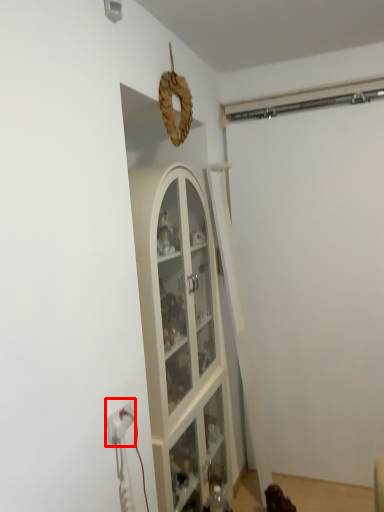
Question: In this image, where is electric outlet (annotated by the red box) located relative to garage door?

Choices:
 (A) right
 (B) left

Answer: (B)